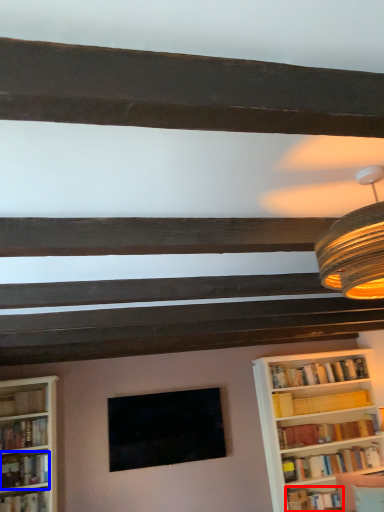
Question: Which object is closer to the camera taking this photo, book (highlighted by a red box) or book (highlighted by a blue box)?

Choices:
 (A) book
 (B) book

Answer: (B)